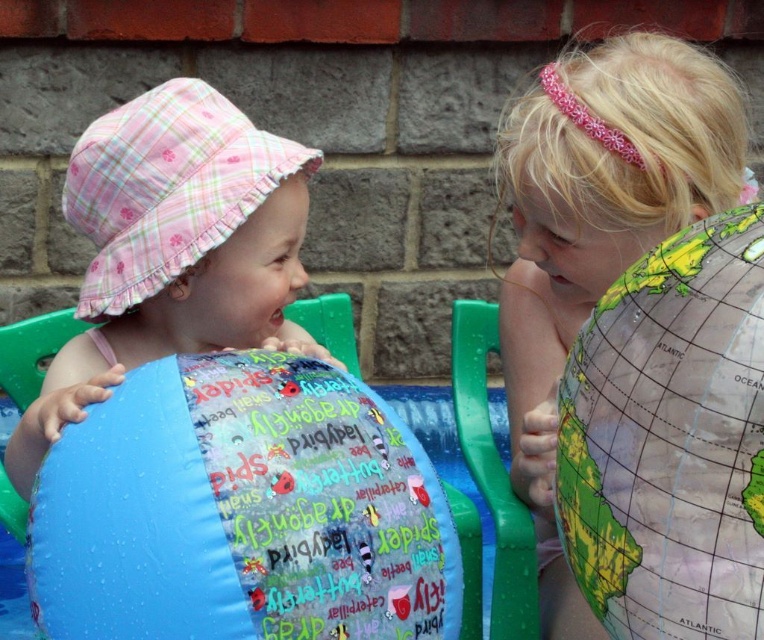
Question: Where is blue rubber beach ball at left located in relation to pink plaid hat at left in the image?

Choices:
 (A) right
 (B) left

Answer: (A)

Question: Does transparent plastic globe at right have a lesser width compared to pink plaid hat at left?

Choices:
 (A) no
 (B) yes

Answer: (B)

Question: Which object is positioned closest to the pink plaid hat at left?

Choices:
 (A) blue rubber beach ball at left
 (B) transparent plastic globe at right

Answer: (A)

Question: Which point is farther from the camera taking this photo?

Choices:
 (A) (743, 362)
 (B) (151, 483)
 (C) (91, 284)

Answer: (C)

Question: Can you confirm if transparent plastic globe at right is positioned below pink plaid hat at left?

Choices:
 (A) yes
 (B) no

Answer: (A)

Question: Which of the following is the closest to the observer?

Choices:
 (A) pink plaid hat at left
 (B) blue rubber beach ball at left

Answer: (B)